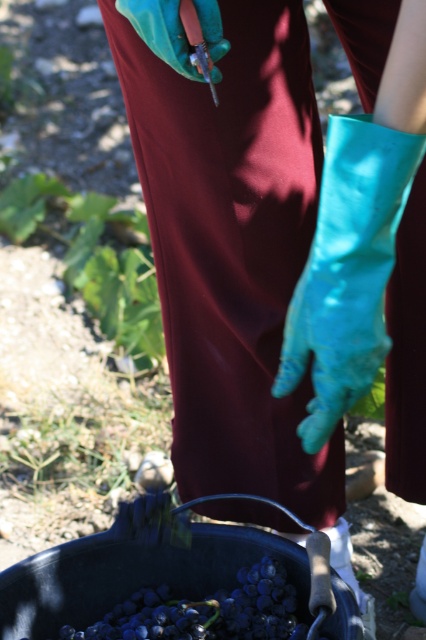
Between point (261, 579) and point (118, 10), which one is positioned behind?

Point (261, 579)

Locate an element on the screen. Image resolution: width=426 pixels, height=640 pixels. shiny purple grapes at lower center is located at coordinates (207, 611).

Does teal rubber glove at center appear on the right side of shiny purple grapes at lower center?

Correct, you'll find teal rubber glove at center to the right of shiny purple grapes at lower center.

Who is shorter, teal rubber glove at center or shiny purple grapes at lower center?

shiny purple grapes at lower center is shorter.

Identify the location of teal rubber glove at center. This screenshot has height=640, width=426. (347, 269).

Image resolution: width=426 pixels, height=640 pixels. What do you see at coordinates (347, 269) in the screenshot?
I see `teal rubber glove at center` at bounding box center [347, 269].

Locate an element on the screen. The width and height of the screenshot is (426, 640). teal rubber glove at center is located at coordinates (347, 269).

Is point (379, 280) less distant than point (166, 32)?

That is True.

This screenshot has width=426, height=640. Identify the location of teal rubber glove at center. (347, 269).